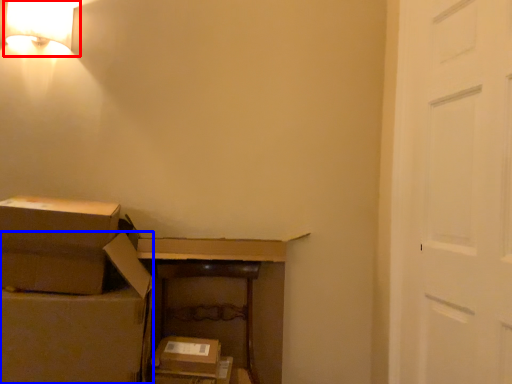
Question: Which object is closer to the camera taking this photo, lamp (highlighted by a red box) or storage box (highlighted by a blue box)?

Choices:
 (A) lamp
 (B) storage box

Answer: (B)